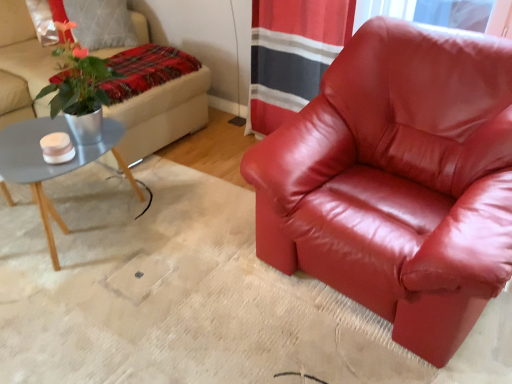
This screenshot has height=384, width=512. Identify the location of vacant area that lies between matte gray coffee table at left and satin red armchair at center. (196, 264).